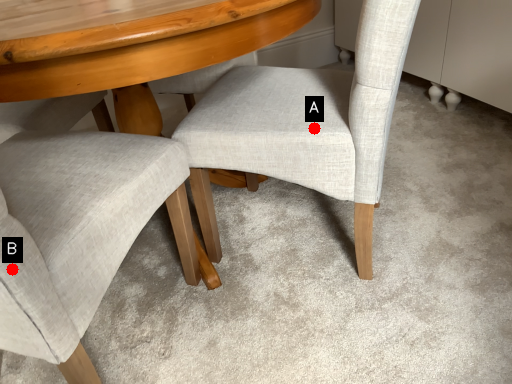
Question: Two points are circled on the image, labeled by A and B beside each circle. Among these points, which one is nearest to the camera?

Choices:
 (A) A is closer
 (B) B is closer

Answer: (B)